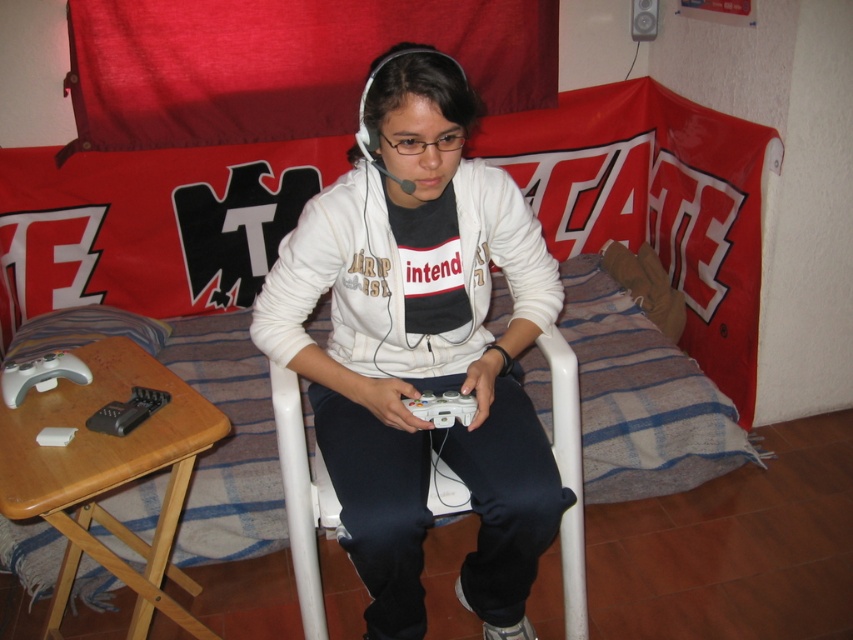
Question: Does white matte game controller at left have a lesser width compared to white matte game controller at lower center?

Choices:
 (A) no
 (B) yes

Answer: (A)

Question: Which point is closer to the camera taking this photo?

Choices:
 (A) (410, 51)
 (B) (4, 371)

Answer: (A)

Question: Which point appears closest to the camera in this image?

Choices:
 (A) (433, 340)
 (B) (21, 371)
 (C) (459, 394)

Answer: (C)

Question: Is white matte jacket at center closer to the viewer compared to white matte game controller at lower center?

Choices:
 (A) no
 (B) yes

Answer: (B)

Question: Is white matte jacket at center smaller than white matte game controller at lower center?

Choices:
 (A) no
 (B) yes

Answer: (A)

Question: Which object is the closest to the white matte game controller at lower center?

Choices:
 (A) white matte game controller at left
 (B) white matte jacket at center

Answer: (B)